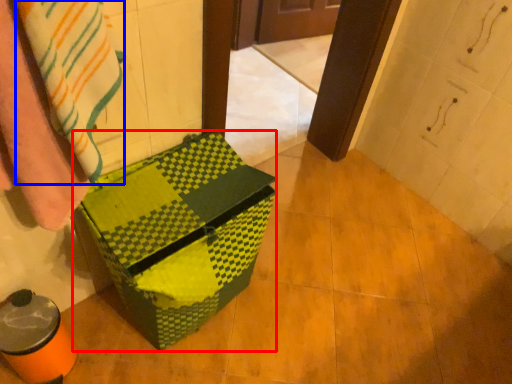
Question: Which of the following is the closest to the observer, cardboard box (highlighted by a red box) or blanket (highlighted by a blue box)?

Choices:
 (A) cardboard box
 (B) blanket

Answer: (B)